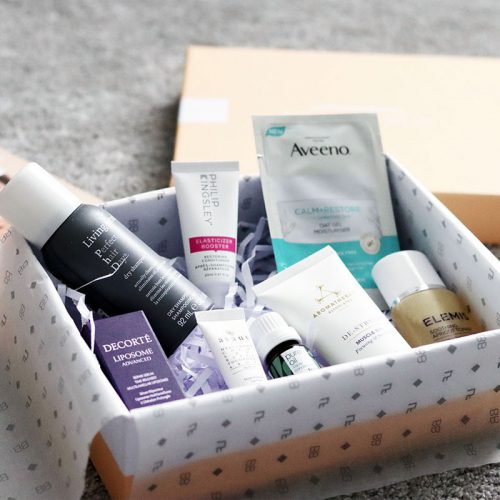
The height and width of the screenshot is (500, 500). I want to click on inside back of gift box, so tap(157, 226), tap(159, 237), tap(250, 208).